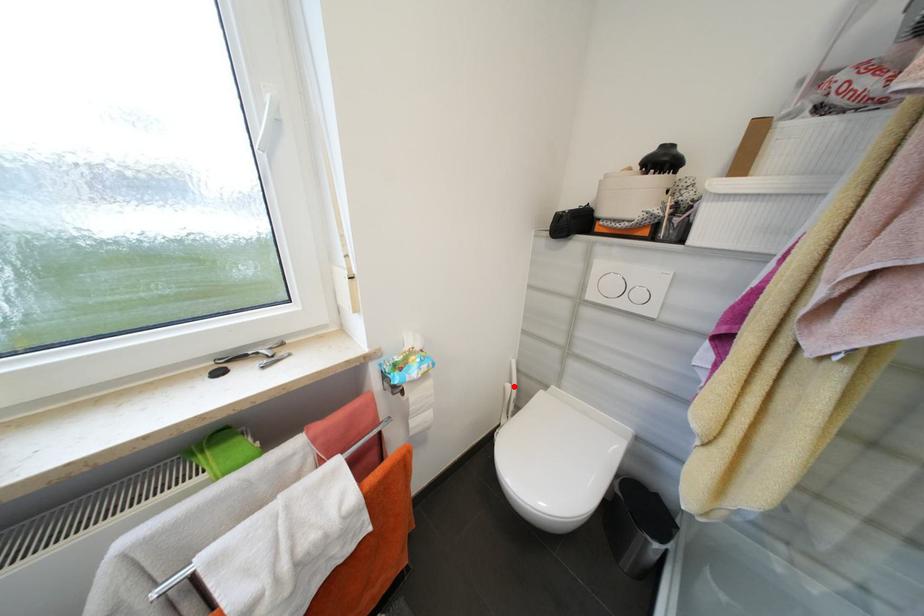
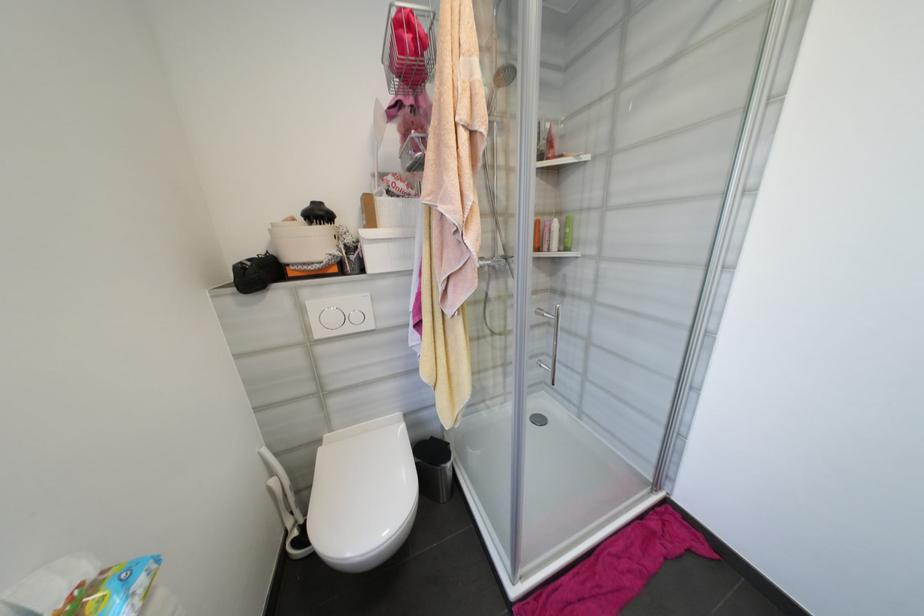
The point at the highlighted location is marked in the first image. Where is the corresponding point in the second image?

(277, 482)